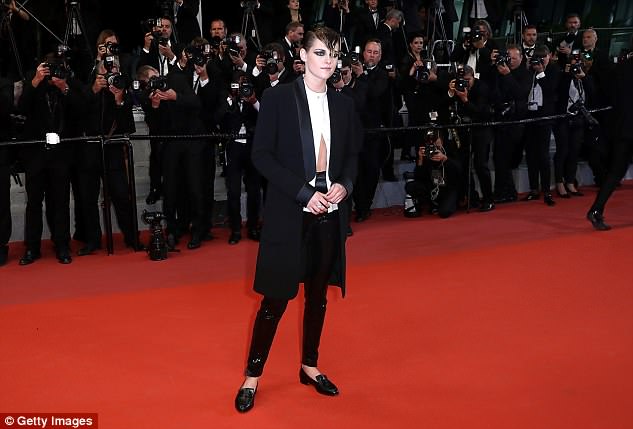
Where is `red carpet`? The width and height of the screenshot is (633, 429). red carpet is located at coordinates (463, 311).